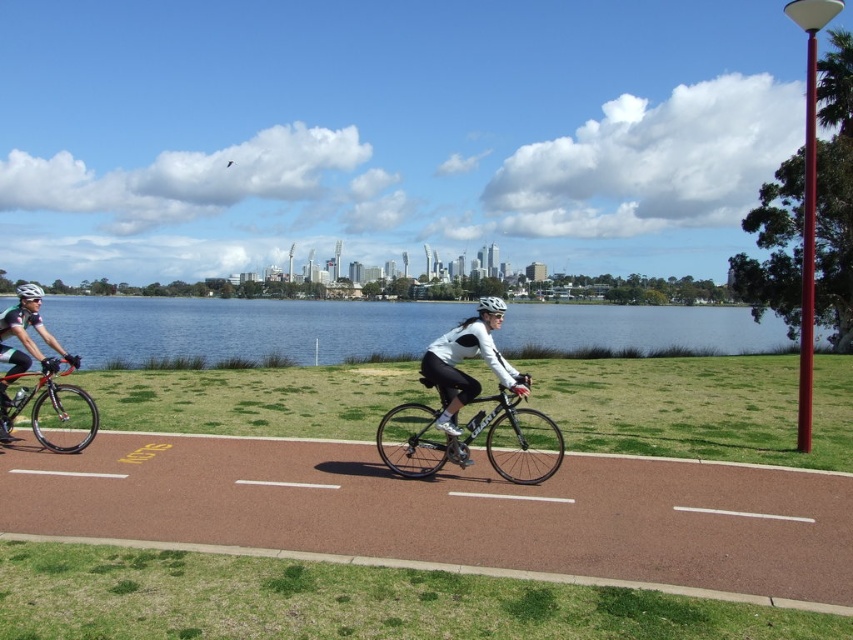
Measure the distance between green matte cycling jersey at left and camera.

green matte cycling jersey at left is 7.82 meters from camera.

Is point (10, 356) closer to camera compared to point (497, 296)?

Yes, it is.

At what (x,y) coordinates should I click in order to perform the action: click on green matte cycling jersey at left. Please return your answer as a coordinate pair (x, y). Looking at the image, I should click on (22, 352).

Between green matte cycling jersey at left and white matte bicycle helmet at left, which one is positioned higher?

Positioned higher is white matte bicycle helmet at left.

Does green matte cycling jersey at left have a lesser height compared to white matte bicycle helmet at left?

No.

Who is more forward, (4, 337) or (24, 282)?

Positioned in front is point (4, 337).

Where is `green matte cycling jersey at left`? This screenshot has height=640, width=853. green matte cycling jersey at left is located at coordinates (22, 352).

Is point (408, 308) less distant than point (488, 433)?

No, it is not.

Between blue water at center and shiny black bike at center, which one has less height?

shiny black bike at center is shorter.

Find the location of a particular element. blue water at center is located at coordinates (242, 326).

Where is `blue water at center`? blue water at center is located at coordinates coord(242,326).